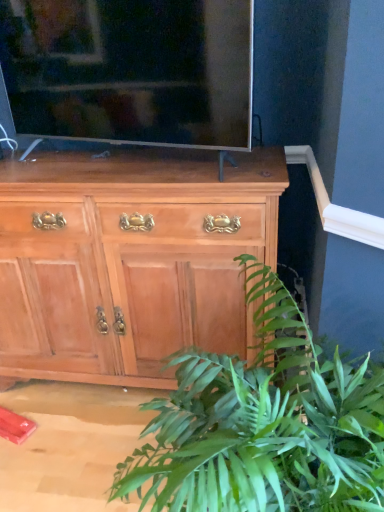
Question: Is light brown wood cabinet at center inside the boundaries of green leafy plant at lower right, or outside?

Choices:
 (A) outside
 (B) inside

Answer: (A)

Question: Considering the positions of point (41, 297) and point (220, 397), is point (41, 297) closer or farther from the camera than point (220, 397)?

Choices:
 (A) farther
 (B) closer

Answer: (A)

Question: Considering the real-world distances, which object is closest to the light brown wood cabinet at center?

Choices:
 (A) green leafy plant at lower right
 (B) matte black tv at upper center

Answer: (B)

Question: Estimate the real-world distances between objects in this image. Which object is closer to the green leafy plant at lower right?

Choices:
 (A) light brown wood cabinet at center
 (B) matte black tv at upper center

Answer: (A)